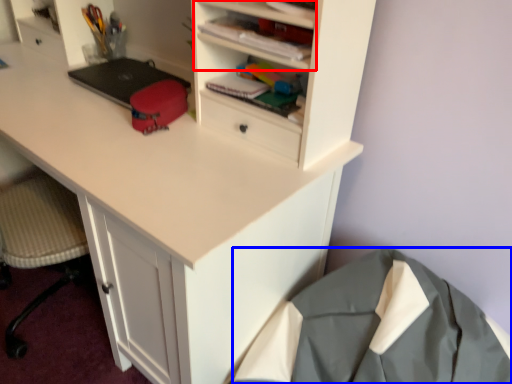
Question: Which object is closer to the camera taking this photo, cabinet (highlighted by a red box) or clothing (highlighted by a blue box)?

Choices:
 (A) cabinet
 (B) clothing

Answer: (B)